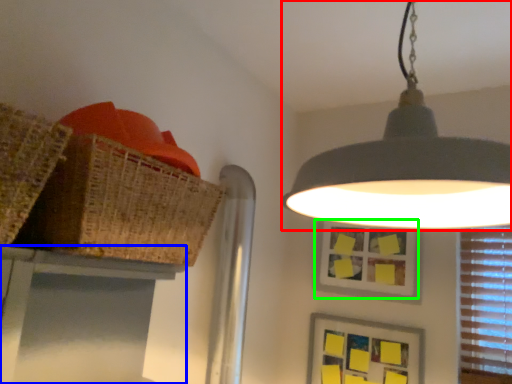
Question: Which object is the farthest from lamp (highlighted by a red box)? Choose among these: table (highlighted by a blue box) or picture frame (highlighted by a green box).

Choices:
 (A) table
 (B) picture frame

Answer: (B)